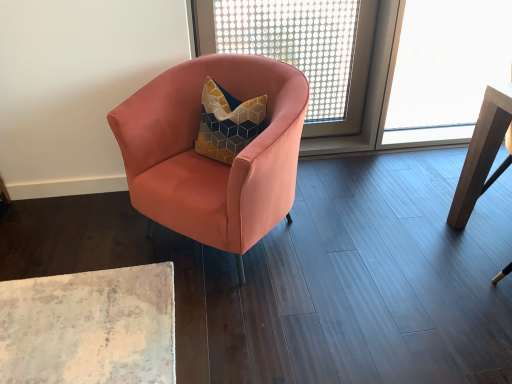
Locate an element on the screen. free space to the left of wooden table at right is located at coordinates (433, 213).